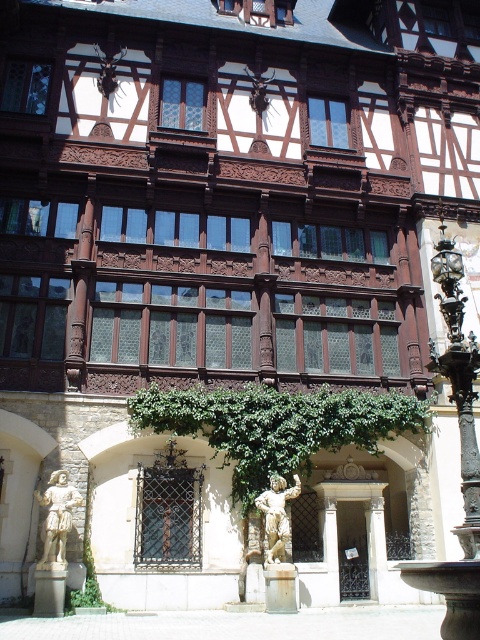
Question: Among these objects, which one is nearest to the camera?

Choices:
 (A) smooth stone pillar at lower left
 (B) white stone statue at lower left
 (C) green leafy ivy at center
 (D) rustic stone pillar at center

Answer: (A)

Question: Is green leafy ivy at center positioned in front of white stone statue at lower left?

Choices:
 (A) no
 (B) yes

Answer: (A)

Question: Can you confirm if green leafy ivy at center is positioned above smooth stone pillar at lower left?

Choices:
 (A) yes
 (B) no

Answer: (A)

Question: Which of the following is the farthest from the observer?

Choices:
 (A) white stone statue at lower left
 (B) green leafy ivy at center

Answer: (B)

Question: Is stone statue at center behind rustic stone pillar at center?

Choices:
 (A) yes
 (B) no

Answer: (A)

Question: Which object is the closest to the rustic stone pillar at center?

Choices:
 (A) white stone statue at lower left
 (B) stone statue at center
 (C) green leafy ivy at center

Answer: (B)